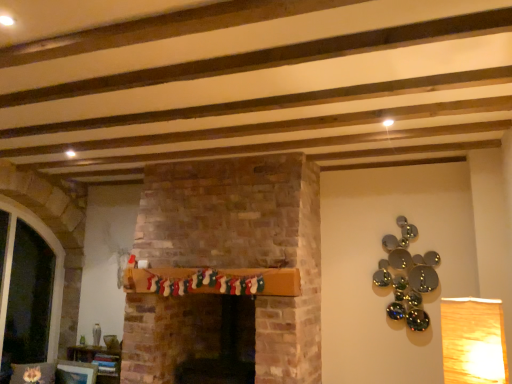
Question: From a real-world perspective, is matte white picture frame at lower left under wooden bookshelf at lower left?

Choices:
 (A) no
 (B) yes

Answer: (B)

Question: Considering the relative sizes of matte white picture frame at lower left and wooden bookshelf at lower left in the image provided, is matte white picture frame at lower left wider than wooden bookshelf at lower left?

Choices:
 (A) no
 (B) yes

Answer: (A)

Question: Can you confirm if matte white picture frame at lower left is thinner than wooden bookshelf at lower left?

Choices:
 (A) yes
 (B) no

Answer: (A)

Question: Is matte white picture frame at lower left oriented away from wooden bookshelf at lower left?

Choices:
 (A) no
 (B) yes

Answer: (B)

Question: Does matte white picture frame at lower left have a greater height compared to wooden bookshelf at lower left?

Choices:
 (A) no
 (B) yes

Answer: (A)

Question: Considering the relative sizes of matte white picture frame at lower left and wooden bookshelf at lower left in the image provided, is matte white picture frame at lower left shorter than wooden bookshelf at lower left?

Choices:
 (A) yes
 (B) no

Answer: (A)

Question: From the image's perspective, is matte white picture frame at lower left on transparent glass door at left?

Choices:
 (A) yes
 (B) no

Answer: (B)

Question: Is the depth of matte white picture frame at lower left greater than that of transparent glass door at left?

Choices:
 (A) no
 (B) yes

Answer: (B)

Question: Does matte white picture frame at lower left appear on the right side of transparent glass door at left?

Choices:
 (A) yes
 (B) no

Answer: (A)

Question: From a real-world perspective, is matte white picture frame at lower left below transparent glass door at left?

Choices:
 (A) yes
 (B) no

Answer: (A)

Question: Is matte white picture frame at lower left facing away from transparent glass door at left?

Choices:
 (A) yes
 (B) no

Answer: (B)

Question: From a real-world perspective, is matte white picture frame at lower left positioned over transparent glass door at left based on gravity?

Choices:
 (A) yes
 (B) no

Answer: (B)

Question: From the image's perspective, is wooden bookshelf at lower left under transparent glass door at left?

Choices:
 (A) no
 (B) yes

Answer: (B)